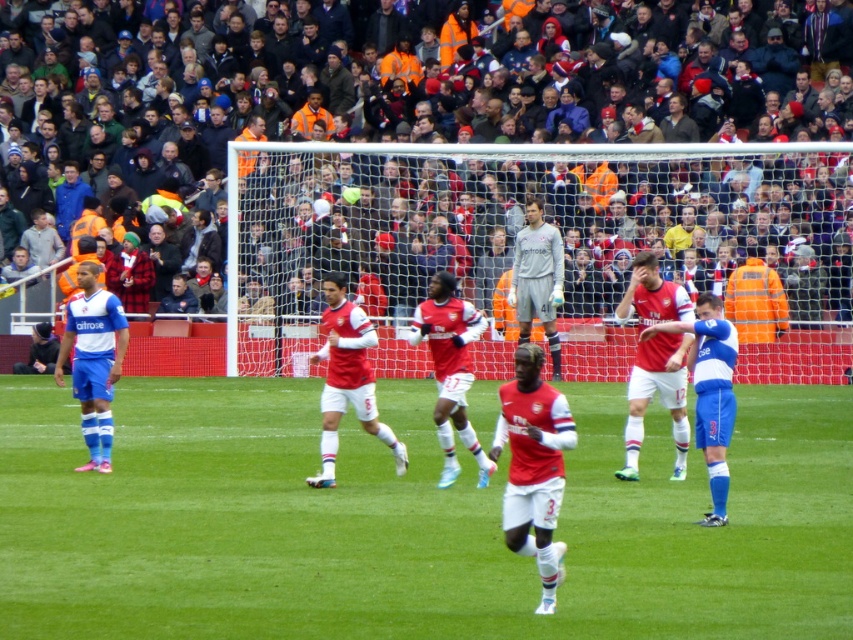
Can you confirm if matte red jersey at center is smaller than blue jersey at left?

Yes, matte red jersey at center is smaller than blue jersey at left.

Who is taller, matte red jersey at center or blue jersey at left?

matte red jersey at center is taller.

Where is `matte red jersey at center`? This screenshot has width=853, height=640. matte red jersey at center is located at coordinates (659, 397).

Is point (74, 376) farther from viewer compared to point (531, 288)?

No, (74, 376) is in front of (531, 288).

Between point (122, 321) and point (531, 237), which one is positioned in front?

Point (122, 321)

You are a GUI agent. You are given a task and a screenshot of the screen. Output one action in this format:
    pyautogui.click(x=<x>, y=<y>)
    Task: Click on the blue jersey at left
    
    Given the screenshot: What is the action you would take?
    pyautogui.click(x=93, y=360)

Is green grass football field at center thinner than textured fabric crowd at upper center?

Yes, green grass football field at center is thinner than textured fabric crowd at upper center.

How far apart are green grass football field at center and textured fabric crowd at upper center?

5.96 meters

Locate an element on the screen. green grass football field at center is located at coordinates (408, 522).

The image size is (853, 640). What are the coordinates of `green grass football field at center` in the screenshot? It's located at (408, 522).